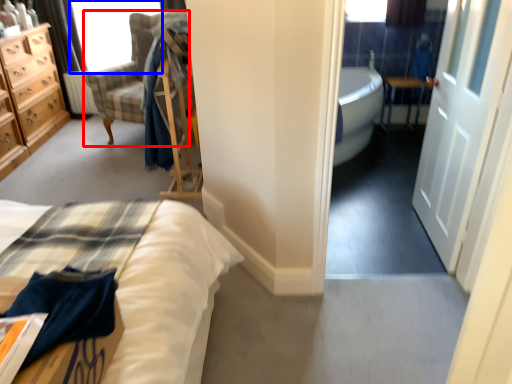
Question: Which object appears closest to the camera in this image, chair (highlighted by a red box) or window screen (highlighted by a blue box)?

Choices:
 (A) chair
 (B) window screen

Answer: (A)